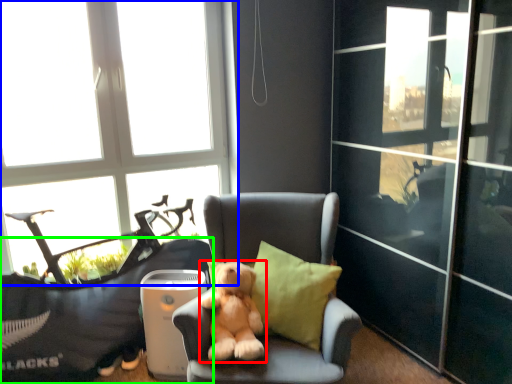
Question: Which object is positioned closest to dog (highlighted by a red box)? Select from window (highlighted by a blue box) and furniture (highlighted by a green box).

Choices:
 (A) window
 (B) furniture

Answer: (B)